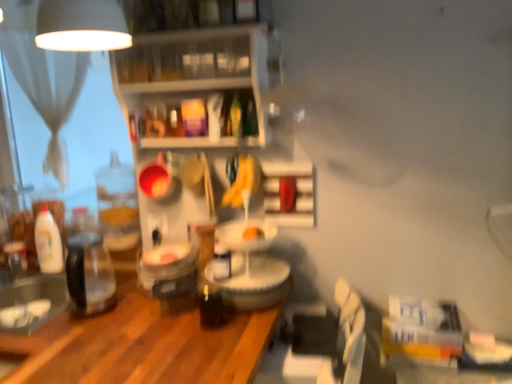
Question: In the image, is white matte shelf at center, the first shelf when ordered from right to left, positioned in front of or behind clear plastic shelves at upper center, the first shelf in the left-to-right sequence?

Choices:
 (A) behind
 (B) front

Answer: (A)

Question: Considering the positions of white matte shelf at center, the 2th shelf when ordered from top to bottom, and clear plastic shelves at upper center, which ranks as the 2th shelf in right-to-left order, in the image, is white matte shelf at center, the 2th shelf when ordered from top to bottom, wider or thinner than clear plastic shelves at upper center, which ranks as the 2th shelf in right-to-left order,?

Choices:
 (A) thin
 (B) wide

Answer: (A)

Question: Considering the real-world distances, which object is closest to the white glossy bottle at left?

Choices:
 (A) yellow matte bananas at center
 (B) wooden table at center
 (C) white matte shelf at center, the 2th shelf when ordered from top to bottom
 (D) clear plastic shelves at upper center, the first shelf in the left-to-right sequence
 (E) clear glass jar at left

Answer: (E)

Question: Which object is the closest to the wooden table at center?

Choices:
 (A) clear plastic shelves at upper center, marked as the 1th shelf in a top-to-bottom arrangement
 (B) white matte shelf at center, the 2th shelf when ordered from top to bottom
 (C) clear glass jar at left
 (D) white glossy bottle at left
 (E) yellow matte bananas at center

Answer: (C)